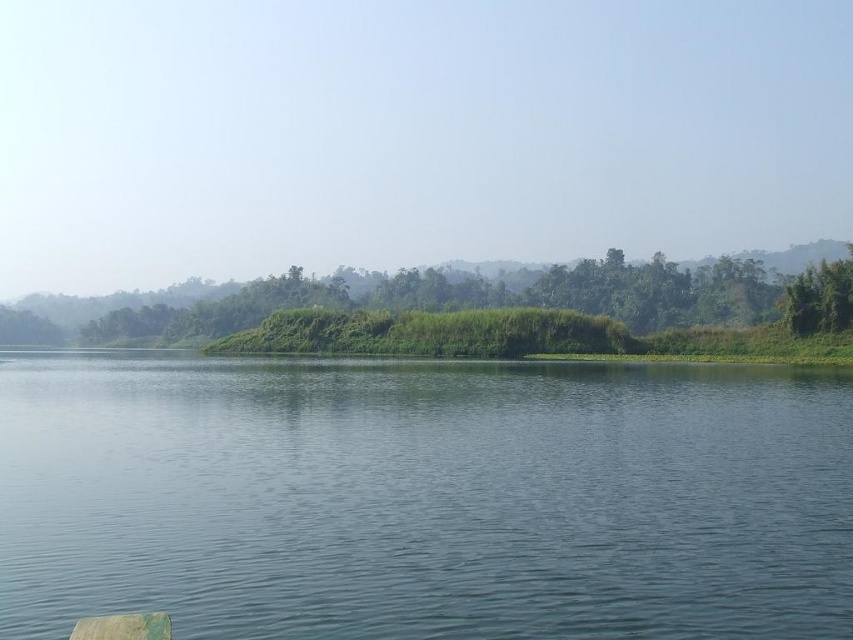
Question: Is blue smooth water at center smaller than green leafy tree at right?

Choices:
 (A) no
 (B) yes

Answer: (A)

Question: Considering the relative positions of green grassy mound at center and green leafy tree at right in the image provided, where is green grassy mound at center located with respect to green leafy tree at right?

Choices:
 (A) below
 (B) above

Answer: (B)

Question: Which object is positioned closest to the green grassy mound at center?

Choices:
 (A) green leafy tree at right
 (B) blue smooth water at center

Answer: (A)

Question: Which point is farther from the camera taking this photo?

Choices:
 (A) (814, 317)
 (B) (361, 296)

Answer: (B)

Question: Considering the relative positions of blue smooth water at center and green leafy tree at right in the image provided, where is blue smooth water at center located with respect to green leafy tree at right?

Choices:
 (A) above
 (B) below

Answer: (B)

Question: Based on their relative distances, which object is farther from the blue smooth water at center?

Choices:
 (A) green leafy tree at right
 (B) green grassy mound at center

Answer: (B)